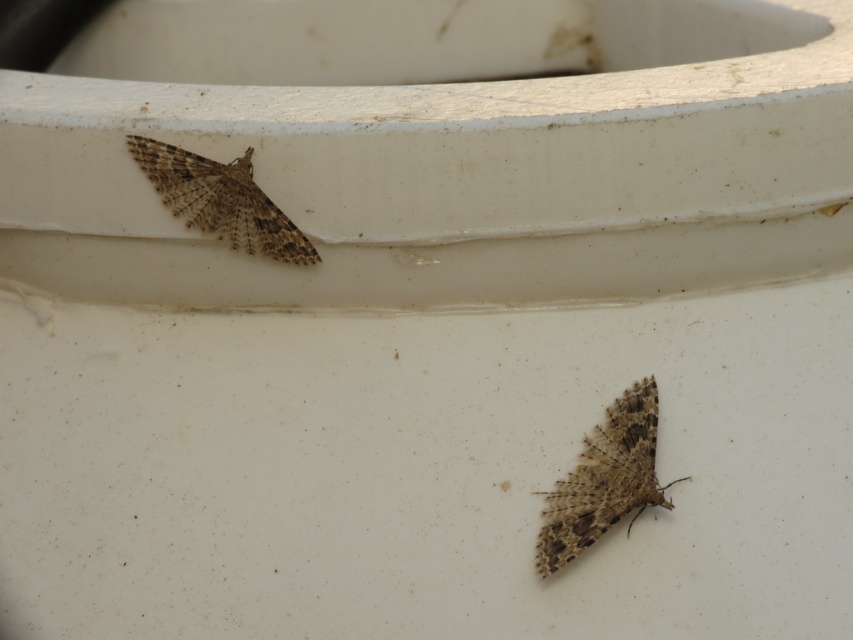
Question: Which object is farther from the camera taking this photo?

Choices:
 (A) brown textured moth at lower center
 (B) brown textured moth at upper left

Answer: (B)

Question: Which of the following is the closest to the observer?

Choices:
 (A) brown textured moth at lower center
 (B) brown textured moth at upper left

Answer: (A)

Question: Is brown textured moth at lower center wider than brown textured moth at upper left?

Choices:
 (A) yes
 (B) no

Answer: (B)

Question: Does brown textured moth at lower center come behind brown textured moth at upper left?

Choices:
 (A) no
 (B) yes

Answer: (A)

Question: Can you confirm if brown textured moth at lower center is thinner than brown textured moth at upper left?

Choices:
 (A) no
 (B) yes

Answer: (B)